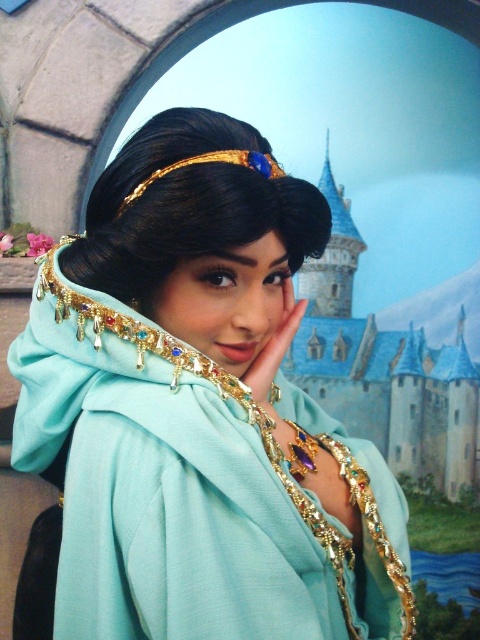
You are a costume designer preparing for a play. You need to ensure that the shiny gold headband at center and the gold metallic tiara at upper center are arranged properly. Which one should be placed higher on the head to match the costume design?

The shiny gold headband at center should be placed higher on the head because it is much taller than the gold metallic tiara at upper center, ensuring proper alignment with the costume design.

You are a costume designer examining the image. You need to decide whether the matte teal fabric at center can cover the shiny gold headband at center if placed over it. Can it?

The matte teal fabric at center is wider than the shiny gold headband at center, so yes, the matte teal fabric at center can cover the shiny gold headband at center when placed over it.

From the picture: You are an event planner setting up a photo booth. The backdrop has a castle with blue rooftops. You need to position the matte teal fabric at center so that it aligns with the castle entrance. Can you confirm if the fabric is already placed correctly based on its coordinates?

The matte teal fabric at center is located at point (200, 410). Since the castle entrance coordinates are not provided, I cannot confirm if it aligns. Please provide the entrance coordinates for comparison.